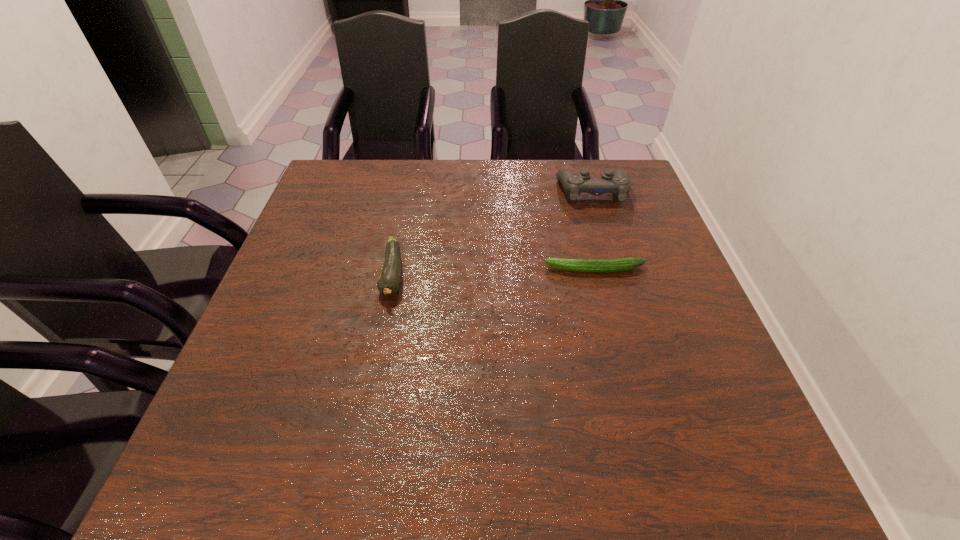
Find the location of a particular element. Image resolution: width=960 pixels, height=540 pixels. vacant space positioned on the front-facing side of the shortest object is located at coordinates pos(498,269).

Where is `object at the far edge`? This screenshot has height=540, width=960. object at the far edge is located at coordinates (618, 183).

What are the coordinates of `control that is at the right edge` in the screenshot? It's located at (618, 183).

The width and height of the screenshot is (960, 540). I want to click on zucchini at the right edge, so click(619, 264).

Locate an element on the screen. object that is at the far right corner is located at coordinates (618, 183).

In the image, there is a desktop. Identify the location of vacant area at the far edge. Image resolution: width=960 pixels, height=540 pixels. point(419,175).

In the image, there is a desktop. Identify the location of blank space at the left edge. (297, 293).

Locate an element on the screen. The height and width of the screenshot is (540, 960). vacant area at the right edge of the desktop is located at coordinates (657, 303).

Image resolution: width=960 pixels, height=540 pixels. In order to click on vacant region at the near left corner of the desktop in this screenshot , I will do click(x=275, y=465).

Identify the location of vacant space at the far right corner of the desktop. (634, 202).